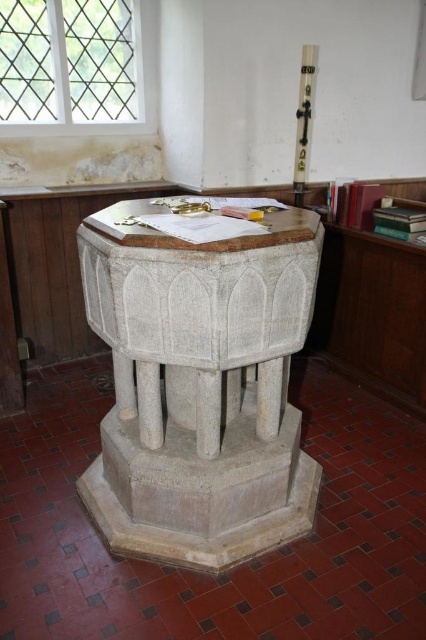
This screenshot has height=640, width=426. Describe the element at coordinates (199, 387) in the screenshot. I see `white stone baptismal font at center` at that location.

Can you confirm if white stone baptismal font at center is shorter than white polished wood cross at upper right?

No, white stone baptismal font at center is not shorter than white polished wood cross at upper right.

Is point (109, 296) positioned after point (299, 188)?

That is False.

Find the location of `white stone baptismal font at center`. white stone baptismal font at center is located at coordinates (199, 387).